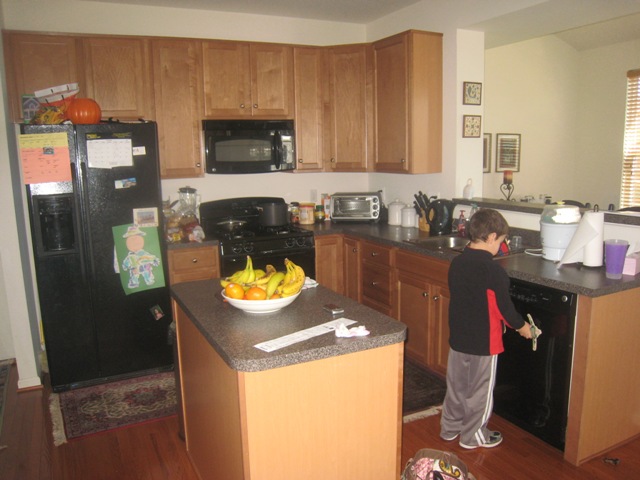
This screenshot has width=640, height=480. I want to click on bowl, so point(266,302).